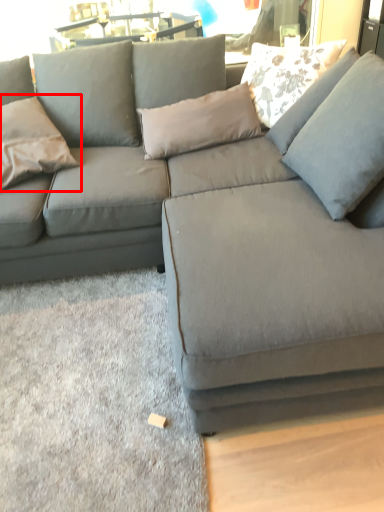
Question: From the image's perspective, where is pillow (annotated by the red box) located relative to pillow?

Choices:
 (A) below
 (B) above

Answer: (A)